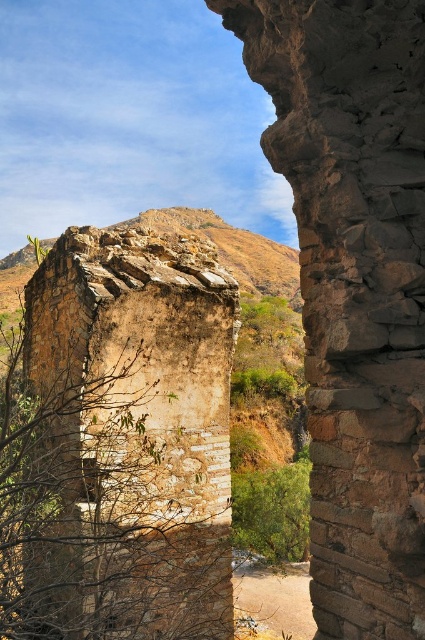
Does point (311, 145) come closer to viewer compared to point (161, 461)?

Yes, it is in front of point (161, 461).

Who is more distant from viewer, (384, 564) or (57, 298)?

Point (57, 298)

The height and width of the screenshot is (640, 425). I want to click on brown rough stone wall at center, so click(x=354, y=288).

Identify the location of brown rough stone wall at center. (354, 288).